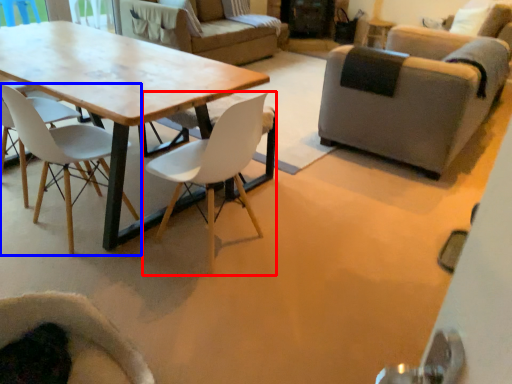
Question: Which object is further to the camera taking this photo, chair (highlighted by a red box) or chair (highlighted by a blue box)?

Choices:
 (A) chair
 (B) chair

Answer: (B)